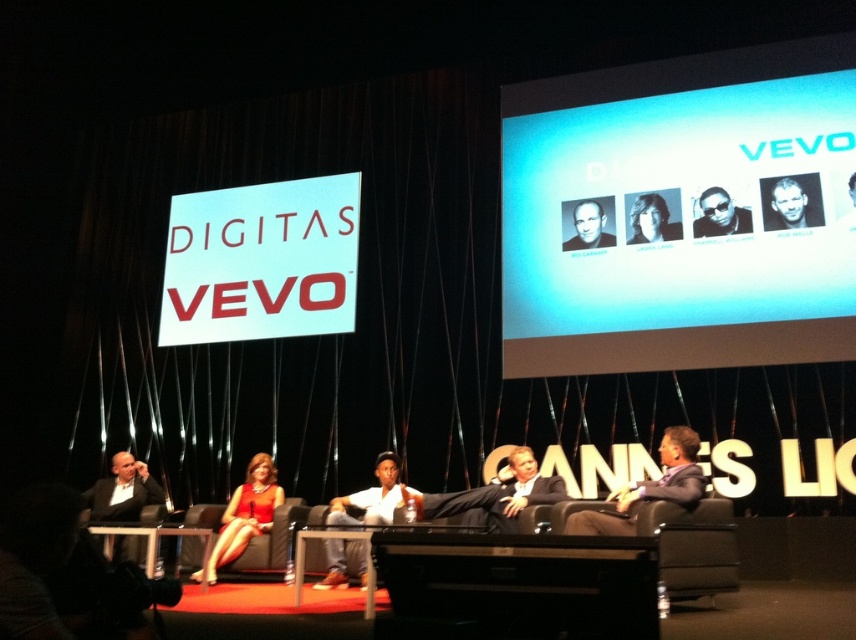
Question: Which of these objects is positioned farthest from the smooth skin face at upper right?

Choices:
 (A) sunglasses at center
 (B) blue glossy screen at upper center

Answer: (B)

Question: Can you confirm if light brown hair at center is thinner than smooth skin face at center?

Choices:
 (A) no
 (B) yes

Answer: (B)

Question: Is shiny red dress at center above sunglasses at center?

Choices:
 (A) no
 (B) yes

Answer: (A)

Question: Is smooth skin face at upper right positioned behind smooth skin face at center?

Choices:
 (A) yes
 (B) no

Answer: (B)

Question: Which point is farther to the camera?

Choices:
 (A) light brown hair at center
 (B) blue glossy screen at upper center
 (C) shiny red dress at center
 (D) smooth skin face at upper right

Answer: (A)

Question: Considering the real-world distances, which object is farthest from the light brown hair at center?

Choices:
 (A) blue glossy screen at upper center
 (B) gray suit at center

Answer: (B)